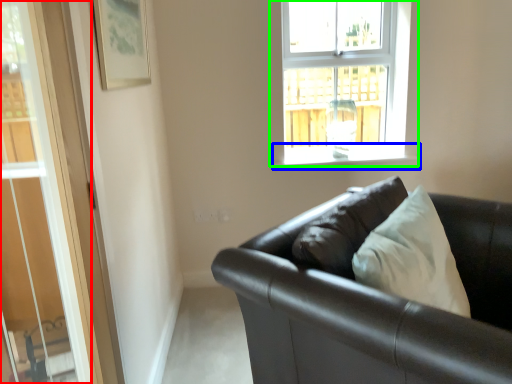
Question: Which is farther away from glass door (highlighted by a red box)? window sill (highlighted by a blue box) or window (highlighted by a green box)?

Choices:
 (A) window sill
 (B) window

Answer: (B)